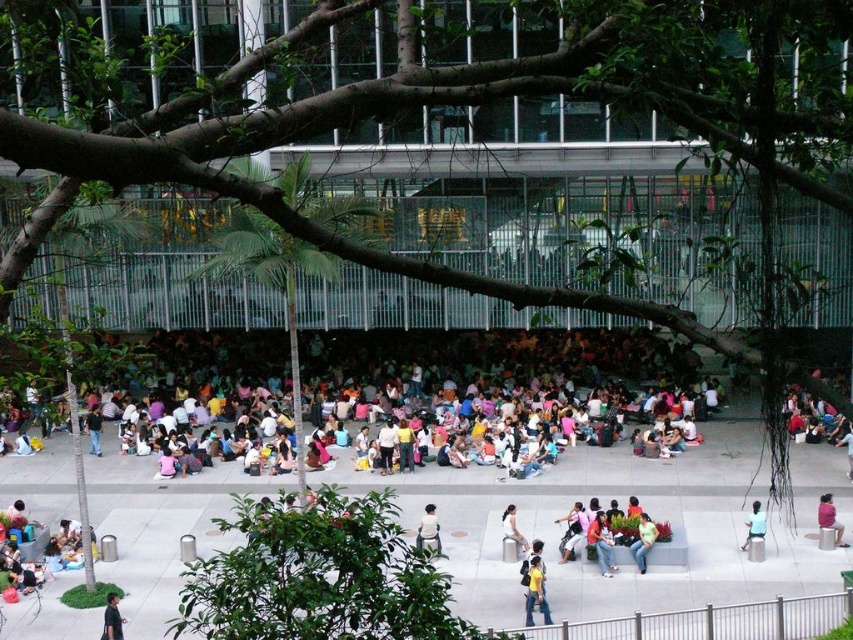
Between green leafy tree at center and blue fabric shirt at lower right, which one appears on the right side from the viewer's perspective?

Positioned to the right is blue fabric shirt at lower right.

Does point (223, 269) come in front of point (753, 506)?

No, (223, 269) is behind (753, 506).

This screenshot has height=640, width=853. Find the location of `green leafy tree at center`. green leafy tree at center is located at coordinates (271, 282).

At what (x,y) coordinates should I click in order to perform the action: click on green leafy tree at center. Please return your answer as a coordinate pair (x, y). This screenshot has width=853, height=640. Looking at the image, I should click on coord(271,282).

Who is more distant from viewer, (x=598, y=531) or (x=521, y=541)?

Point (x=521, y=541)

Who is lower down, denim jacket at center or light brown leather jacket at center?

Positioned lower is denim jacket at center.

This screenshot has width=853, height=640. In order to click on denim jacket at center in this screenshot , I will do `click(601, 544)`.

At what (x,y) coordinates should I click in order to perform the action: click on denim jacket at center. Please return your answer as a coordinate pair (x, y). The height and width of the screenshot is (640, 853). Looking at the image, I should click on (601, 544).

Locate an element on the screen. The width and height of the screenshot is (853, 640). yellow cotton shirt at center is located at coordinates (535, 593).

Can you confirm if yellow cotton shirt at center is smaller than green fabric person at lower right?

No, yellow cotton shirt at center is not smaller than green fabric person at lower right.

Is point (534, 588) positioned in front of point (636, 561)?

Yes, it is in front of point (636, 561).

At what (x,y) coordinates should I click in order to perform the action: click on yellow cotton shirt at center. Please return your answer as a coordinate pair (x, y). This screenshot has width=853, height=640. Looking at the image, I should click on (535, 593).